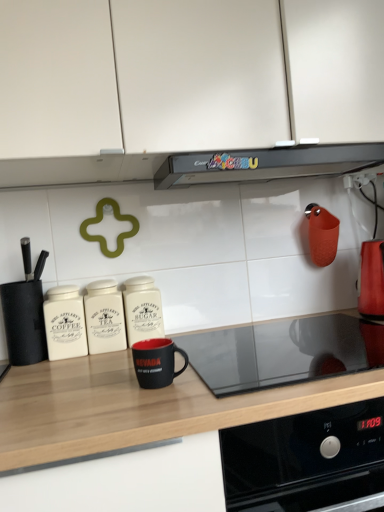
Image resolution: width=384 pixels, height=512 pixels. Describe the element at coordinates (65, 323) in the screenshot. I see `white ceramic coffee canister at left, which ranks as the second kitchen appliance in left-to-right order` at that location.

This screenshot has height=512, width=384. I want to click on white ceramic canister at center, the third kitchen appliance viewed from the left, so click(104, 317).

In order to face black matte mug at center, placed as the 4th kitchen appliance when sorted from left to right, should I rotate leftwards or rightwards?

To align with it, rotate left about 4.762°.

How much space does black plastic range hood at upper center, which ranks as the 2th kitchen appliance in right-to-left order, occupy vertically?

black plastic range hood at upper center, which ranks as the 2th kitchen appliance in right-to-left order, is 2.02 inches tall.

What do you see at coordinates (137, 407) in the screenshot? I see `black matte countertop at center` at bounding box center [137, 407].

What is the approximate height of black glass cooktop at center?

black glass cooktop at center is 1.00 inches tall.

Locate an element on the screen. This screenshot has height=512, width=384. white ceramic coffee canister at left, which ranks as the 5th kitchen appliance in right-to-left order is located at coordinates (65, 323).

Considering the positions of objects black plastic range hood at upper center, which ranks as the 2th kitchen appliance in right-to-left order, and white matte cabinet at upper center in the image provided, who is in front, black plastic range hood at upper center, which ranks as the 2th kitchen appliance in right-to-left order, or white matte cabinet at upper center?

Positioned in front is white matte cabinet at upper center.

Looking at their sizes, would you say black plastic range hood at upper center, the fifth kitchen appliance from the left, is wider or thinner than white matte cabinet at upper center?

In the image, black plastic range hood at upper center, the fifth kitchen appliance from the left, appears to be more narrow than white matte cabinet at upper center.

Looking at this image, are black plastic range hood at upper center, the fifth kitchen appliance from the left, and white matte cabinet at upper center beside each other?

They are not placed beside each other.

Is point (231, 174) more distant than point (193, 77)?

Yes.

Locate an element on the screen. This screenshot has height=512, width=384. countertop in front of the black plastic range hood at upper center, which ranks as the 2th kitchen appliance in right-to-left order is located at coordinates (137, 407).

Could you measure the distance between black matte countertop at center and black plastic range hood at upper center, which ranks as the 2th kitchen appliance in right-to-left order?

black matte countertop at center is 22.36 inches away from black plastic range hood at upper center, which ranks as the 2th kitchen appliance in right-to-left order.

Does black matte countertop at center appear on the right side of black plastic range hood at upper center, which ranks as the 2th kitchen appliance in right-to-left order?

Incorrect, black matte countertop at center is not on the right side of black plastic range hood at upper center, which ranks as the 2th kitchen appliance in right-to-left order.

From the image's perspective, which is above, black matte countertop at center or black plastic range hood at upper center, the fifth kitchen appliance from the left?

From the image's view, black plastic range hood at upper center, the fifth kitchen appliance from the left, is above.

From the image's perspective, is black plastic range hood at upper center, the fifth kitchen appliance from the left, above or below white ceramic canister at center, the third kitchen appliance viewed from the left?

black plastic range hood at upper center, the fifth kitchen appliance from the left, is above white ceramic canister at center, the third kitchen appliance viewed from the left.

Looking at this image, could you tell me if black plastic range hood at upper center, which ranks as the 2th kitchen appliance in right-to-left order, is turned towards white ceramic canister at center, the third kitchen appliance viewed from the left?

No.

Which point is more forward, (195,169) or (97,344)?

The point (195,169) is more forward.

Which of these two, black plastic range hood at upper center, which ranks as the 2th kitchen appliance in right-to-left order, or white ceramic canister at center, which is counted as the fourth kitchen appliance, starting from the right, is smaller?

Smaller between the two is white ceramic canister at center, which is counted as the fourth kitchen appliance, starting from the right.

Who is shorter, white ceramic canister at center, the third kitchen appliance viewed from the left, or black glass cooktop at center?

black glass cooktop at center is shorter.

From a real-world perspective, who is located higher, white ceramic canister at center, which is counted as the fourth kitchen appliance, starting from the right, or black glass cooktop at center?

white ceramic canister at center, which is counted as the fourth kitchen appliance, starting from the right, from a real-world perspective.

Can you confirm if white ceramic canister at center, the third kitchen appliance viewed from the left, is wider than black glass cooktop at center?

No.

Could you measure the distance between black plastic range hood at upper center, which ranks as the 2th kitchen appliance in right-to-left order, and black matte knife block at left, which appears as the 6th kitchen appliance when viewed from the right?

black plastic range hood at upper center, which ranks as the 2th kitchen appliance in right-to-left order, is 26.46 inches from black matte knife block at left, which appears as the 6th kitchen appliance when viewed from the right.

Are black plastic range hood at upper center, the fifth kitchen appliance from the left, and black matte knife block at left, which appears as the 6th kitchen appliance when viewed from the right, making contact?

They are not placed beside each other.

Can you confirm if black plastic range hood at upper center, the fifth kitchen appliance from the left, is bigger than black matte knife block at left, arranged as the first kitchen appliance when viewed from the left?

Yes, black plastic range hood at upper center, the fifth kitchen appliance from the left, is bigger than black matte knife block at left, arranged as the first kitchen appliance when viewed from the left.

In the scene shown: Can black matte knife block at left, arranged as the first kitchen appliance when viewed from the left, be found inside black plastic range hood at upper center, the fifth kitchen appliance from the left?

No, black matte knife block at left, arranged as the first kitchen appliance when viewed from the left, is not inside black plastic range hood at upper center, the fifth kitchen appliance from the left.

Could you tell me if black matte knife block at left, which appears as the 6th kitchen appliance when viewed from the right, is facing shiny metallic kettle at right, marked as the 1th kitchen appliance in a right-to-left arrangement?

No, black matte knife block at left, which appears as the 6th kitchen appliance when viewed from the right, is not aimed at shiny metallic kettle at right, marked as the 1th kitchen appliance in a right-to-left arrangement.

From a real-world perspective, is black matte knife block at left, arranged as the first kitchen appliance when viewed from the left, over shiny metallic kettle at right, marked as the 1th kitchen appliance in a right-to-left arrangement?

Indeed, from a real-world perspective, black matte knife block at left, arranged as the first kitchen appliance when viewed from the left, stands above shiny metallic kettle at right, marked as the 1th kitchen appliance in a right-to-left arrangement.

Is black matte knife block at left, arranged as the first kitchen appliance when viewed from the left, bigger or smaller than shiny metallic kettle at right, marked as the 1th kitchen appliance in a right-to-left arrangement?

In the image, black matte knife block at left, arranged as the first kitchen appliance when viewed from the left, appears to be smaller than shiny metallic kettle at right, marked as the 1th kitchen appliance in a right-to-left arrangement.

Is black matte knife block at left, arranged as the first kitchen appliance when viewed from the left, not close to shiny metallic kettle at right, marked as the 1th kitchen appliance in a right-to-left arrangement?

Indeed, black matte knife block at left, arranged as the first kitchen appliance when viewed from the left, is not near shiny metallic kettle at right, marked as the 1th kitchen appliance in a right-to-left arrangement.

Does black glass cooktop at center have a lesser width compared to white ceramic canister at center, the third kitchen appliance viewed from the left?

No.

Does point (252, 355) appear closer or farther from the camera than point (112, 326)?

Point (252, 355) is farther from the camera than point (112, 326).

Between black glass cooktop at center and white ceramic canister at center, which is counted as the fourth kitchen appliance, starting from the right, which one has larger size?

Bigger between the two is black glass cooktop at center.

Find the location of a particular element. The height and width of the screenshot is (512, 384). the 1st kitchen appliance counting from the right of the white matte cabinet at upper center is located at coordinates (267, 163).

Identify the location of the 2nd kitchen appliance behind the black matte countertop at center, counting from the anchor's position. The image size is (384, 512). (267, 163).

Based on their spatial positions, is white matte cabinet at upper center or black matte knife block at left, which appears as the 6th kitchen appliance when viewed from the right, further from black plastic range hood at upper center, which ranks as the 2th kitchen appliance in right-to-left order?

black matte knife block at left, which appears as the 6th kitchen appliance when viewed from the right, is further to black plastic range hood at upper center, which ranks as the 2th kitchen appliance in right-to-left order.

Looking at the image, which one is located further to black glass cooktop at center, white matte cabinet at upper center or black matte mug at center, placed as the 4th kitchen appliance when sorted from left to right?

The object further to black glass cooktop at center is white matte cabinet at upper center.

Which object lies further to the anchor point black matte countertop at center, black matte knife block at left, arranged as the first kitchen appliance when viewed from the left, or black plastic range hood at upper center, the fifth kitchen appliance from the left?

The object further to black matte countertop at center is black plastic range hood at upper center, the fifth kitchen appliance from the left.

Looking at the image, which one is located further to shiny metallic kettle at right, marked as the 1th kitchen appliance in a right-to-left arrangement, white matte cabinet at upper center or black matte knife block at left, arranged as the first kitchen appliance when viewed from the left?

black matte knife block at left, arranged as the first kitchen appliance when viewed from the left, is further to shiny metallic kettle at right, marked as the 1th kitchen appliance in a right-to-left arrangement.

Considering their positions, is black matte knife block at left, which appears as the 6th kitchen appliance when viewed from the right, positioned further to white ceramic coffee canister at left, which ranks as the 5th kitchen appliance in right-to-left order, than white matte cabinet at upper center?

white matte cabinet at upper center lies further to white ceramic coffee canister at left, which ranks as the 5th kitchen appliance in right-to-left order, than the other object.

Considering their positions, is black matte knife block at left, which appears as the 6th kitchen appliance when viewed from the right, positioned closer to white ceramic coffee canister at left, which ranks as the 5th kitchen appliance in right-to-left order, than black plastic range hood at upper center, which ranks as the 2th kitchen appliance in right-to-left order?

black matte knife block at left, which appears as the 6th kitchen appliance when viewed from the right, is positioned closer to the anchor white ceramic coffee canister at left, which ranks as the 5th kitchen appliance in right-to-left order.

Based on their spatial positions, is black matte countertop at center or black glass cooktop at center further from black matte knife block at left, which appears as the 6th kitchen appliance when viewed from the right?

black glass cooktop at center is further to black matte knife block at left, which appears as the 6th kitchen appliance when viewed from the right.

When comparing their distances from white ceramic canister at center, which is counted as the fourth kitchen appliance, starting from the right, does white ceramic coffee canister at left, which ranks as the second kitchen appliance in left-to-right order, or black matte knife block at left, which appears as the 6th kitchen appliance when viewed from the right, seem further?

black matte knife block at left, which appears as the 6th kitchen appliance when viewed from the right.

Find the location of a particular element. This screenshot has width=384, height=512. countertop between white ceramic canister at center, which is counted as the fourth kitchen appliance, starting from the right, and shiny metallic kettle at right, the 6th kitchen appliance positioned from the left is located at coordinates (137, 407).

Where is `gas stove that lies between black plastic range hood at upper center, which ranks as the 2th kitchen appliance in right-to-left order, and black matte countertop at center from top to bottom`? gas stove that lies between black plastic range hood at upper center, which ranks as the 2th kitchen appliance in right-to-left order, and black matte countertop at center from top to bottom is located at coordinates (283, 352).

The width and height of the screenshot is (384, 512). Identify the location of gas stove between black matte knife block at left, arranged as the first kitchen appliance when viewed from the left, and shiny metallic kettle at right, marked as the 1th kitchen appliance in a right-to-left arrangement, from left to right. (283, 352).

This screenshot has width=384, height=512. In order to click on kitchen appliance situated between black matte mug at center, the third kitchen appliance in the right-to-left sequence, and shiny metallic kettle at right, the 6th kitchen appliance positioned from the left, from left to right in this screenshot , I will do `click(267, 163)`.